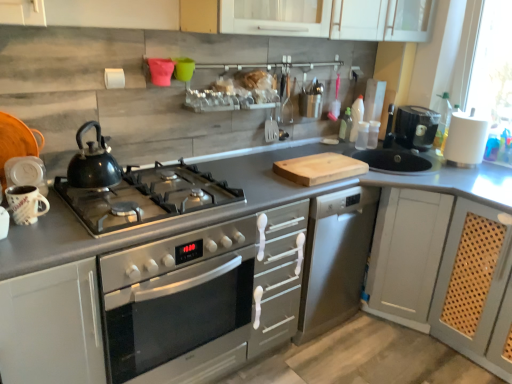
At what (x,y) coordinates should I click in order to perform the action: click on vacant area that is in front of matte ceramic mug at left, the 1th appliance from the left. Please return your answer as a coordinate pair (x, y). Looking at the image, I should click on (29, 246).